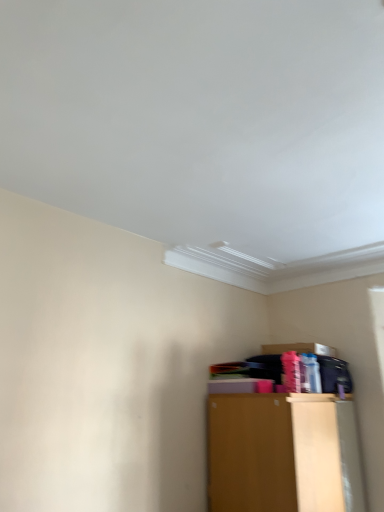
You are a GUI agent. You are given a task and a screenshot of the screen. Output one action in this format:
    pyautogui.click(x=<x>, y=<y>)
    Task: Click on the matte brown cabinet at lower right
    
    Given the screenshot: What is the action you would take?
    pyautogui.click(x=281, y=454)

This screenshot has width=384, height=512. Describe the element at coordinates (281, 454) in the screenshot. I see `matte brown cabinet at lower right` at that location.

I want to click on matte brown cabinet at lower right, so (281, 454).